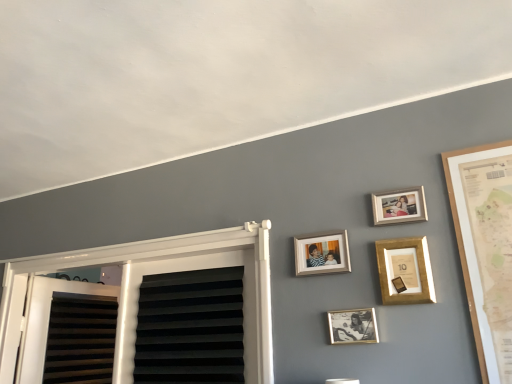
How much space does wooden photo frame at center, the 2th picture frame when ordered from top to bottom, occupy vertically?

6.08 inches.

The image size is (512, 384). Describe the element at coordinates (353, 326) in the screenshot. I see `gold-framed photo at center, acting as the first picture frame starting from the bottom` at that location.

Locate an element on the screen. The height and width of the screenshot is (384, 512). wooden photo frame at upper right, acting as the first picture frame starting from the top is located at coordinates (399, 206).

Is wooden photo frame at center, placed as the 3th picture frame when sorted from bottom to top, to the left or to the right of gold metallic picture frame at upper center, acting as the second picture frame starting from the bottom, in the image?

wooden photo frame at center, placed as the 3th picture frame when sorted from bottom to top, is to the left of gold metallic picture frame at upper center, acting as the second picture frame starting from the bottom.

Is the depth of wooden photo frame at center, placed as the 3th picture frame when sorted from bottom to top, less than that of gold metallic picture frame at upper center, acting as the second picture frame starting from the bottom?

No, it is not.

Is wooden photo frame at center, placed as the 3th picture frame when sorted from bottom to top, located outside gold metallic picture frame at upper center, acting as the second picture frame starting from the bottom?

Yes, wooden photo frame at center, placed as the 3th picture frame when sorted from bottom to top, is not within gold metallic picture frame at upper center, acting as the second picture frame starting from the bottom.

Based on the photo, which of these two, gold metallic picture frame at upper center, acting as the second picture frame starting from the bottom, or wooden photo frame at center, placed as the 3th picture frame when sorted from bottom to top, is thinner?

wooden photo frame at center, placed as the 3th picture frame when sorted from bottom to top, is thinner.

Does point (400, 259) lie in front of point (330, 239)?

Yes, it is in front of point (330, 239).

Can you see gold metallic picture frame at upper center, which is counted as the third picture frame, starting from the top, touching wooden photo frame at center, placed as the 3th picture frame when sorted from bottom to top?

No, gold metallic picture frame at upper center, which is counted as the third picture frame, starting from the top, is not next to wooden photo frame at center, placed as the 3th picture frame when sorted from bottom to top.

Which picture frame is the 2nd one when counting from the front of the wooden photo frame at upper right, placed as the 4th picture frame when sorted from bottom to top? Please provide its 2D coordinates.

[(405, 270)]

Can you confirm if wooden photo frame at upper right, placed as the 4th picture frame when sorted from bottom to top, is taller than gold metallic picture frame at upper center, acting as the second picture frame starting from the bottom?

In fact, wooden photo frame at upper right, placed as the 4th picture frame when sorted from bottom to top, may be shorter than gold metallic picture frame at upper center, acting as the second picture frame starting from the bottom.

Is wooden photo frame at upper right, placed as the 4th picture frame when sorted from bottom to top, spatially inside gold metallic picture frame at upper center, which is counted as the third picture frame, starting from the top, or outside of it?

wooden photo frame at upper right, placed as the 4th picture frame when sorted from bottom to top, is not inside gold metallic picture frame at upper center, which is counted as the third picture frame, starting from the top, it's outside.

Is wooden photo frame at upper right, placed as the 4th picture frame when sorted from bottom to top, directly adjacent to gold metallic picture frame at upper center, which is counted as the third picture frame, starting from the top?

No, wooden photo frame at upper right, placed as the 4th picture frame when sorted from bottom to top, is not next to gold metallic picture frame at upper center, which is counted as the third picture frame, starting from the top.

From the image's perspective, between wooden photo frame at center, placed as the 3th picture frame when sorted from bottom to top, and gold-framed photo at center, arranged as the 4th picture frame when viewed from the top, which one is located above?

wooden photo frame at center, placed as the 3th picture frame when sorted from bottom to top, from the image's perspective.

Is wooden photo frame at center, the 2th picture frame when ordered from top to bottom, smaller than gold-framed photo at center, arranged as the 4th picture frame when viewed from the top?

No.

Would you say wooden photo frame at center, the 2th picture frame when ordered from top to bottom, contains gold-framed photo at center, acting as the first picture frame starting from the bottom?

No.

Could you tell me if wooden photo frame at center, the 2th picture frame when ordered from top to bottom, is facing gold-framed photo at center, acting as the first picture frame starting from the bottom?

No.

Which of these two, gold-framed photo at center, acting as the first picture frame starting from the bottom, or wooden photo frame at center, the 2th picture frame when ordered from top to bottom, is thinner?

gold-framed photo at center, acting as the first picture frame starting from the bottom, is thinner.

Is point (358, 316) closer or farther from the camera than point (339, 259)?

Point (358, 316) is closer to the camera than point (339, 259).

Would you say gold-framed photo at center, acting as the first picture frame starting from the bottom, is a long distance from wooden photo frame at center, the 2th picture frame when ordered from top to bottom?

gold-framed photo at center, acting as the first picture frame starting from the bottom, is near wooden photo frame at center, the 2th picture frame when ordered from top to bottom, not far away.

From a real-world perspective, between gold-framed photo at center, arranged as the 4th picture frame when viewed from the top, and wooden photo frame at center, placed as the 3th picture frame when sorted from bottom to top, who is vertically higher?

wooden photo frame at center, placed as the 3th picture frame when sorted from bottom to top, is physically above.

From a real-world perspective, does gold-framed photo at center, arranged as the 4th picture frame when viewed from the top, sit lower than wooden photo frame at upper right, acting as the first picture frame starting from the top?

Yes, from a real-world perspective, gold-framed photo at center, arranged as the 4th picture frame when viewed from the top, is under wooden photo frame at upper right, acting as the first picture frame starting from the top.

Looking at this image, is gold-framed photo at center, acting as the first picture frame starting from the bottom, not within wooden photo frame at upper right, acting as the first picture frame starting from the top?

Yes.

Who is smaller, gold-framed photo at center, arranged as the 4th picture frame when viewed from the top, or wooden photo frame at upper right, placed as the 4th picture frame when sorted from bottom to top?

Smaller between the two is gold-framed photo at center, arranged as the 4th picture frame when viewed from the top.

Locate an element on the screen. the 2nd picture frame counting from the left side of the wooden photo frame at upper right, placed as the 4th picture frame when sorted from bottom to top is located at coordinates (353, 326).

Is wooden photo frame at upper right, acting as the first picture frame starting from the top, positioned far away from gold-framed photo at center, acting as the first picture frame starting from the bottom?

They are positioned close to each other.

Does wooden photo frame at upper right, acting as the first picture frame starting from the top, have a lesser height compared to gold-framed photo at center, arranged as the 4th picture frame when viewed from the top?

Incorrect, the height of wooden photo frame at upper right, acting as the first picture frame starting from the top, does not fall short of that of gold-framed photo at center, arranged as the 4th picture frame when viewed from the top.

Which object is wider, wooden photo frame at upper right, placed as the 4th picture frame when sorted from bottom to top, or gold-framed photo at center, acting as the first picture frame starting from the bottom?

Wider between the two is wooden photo frame at upper right, placed as the 4th picture frame when sorted from bottom to top.

Is wooden photo frame at upper right, placed as the 4th picture frame when sorted from bottom to top, completely or partially outside of gold-framed photo at center, arranged as the 4th picture frame when viewed from the top?

Yes, wooden photo frame at upper right, placed as the 4th picture frame when sorted from bottom to top, is located beyond the bounds of gold-framed photo at center, arranged as the 4th picture frame when viewed from the top.

At what (x,y) coordinates should I click in order to perform the action: click on picture frame that is the 1st one when counting downward from the wooden photo frame at center, the 2th picture frame when ordered from top to bottom (from the image's perspective). Please return your answer as a coordinate pair (x, y). This screenshot has width=512, height=384. Looking at the image, I should click on (405, 270).

Identify the location of the 2nd picture frame to the left of the gold metallic picture frame at upper center, which is counted as the third picture frame, starting from the top, counting from the anchor's position. (322, 253).

Based on their spatial positions, is gold-framed photo at center, acting as the first picture frame starting from the bottom, or gold metallic picture frame at upper center, acting as the second picture frame starting from the bottom, further from wooden photo frame at upper right, placed as the 4th picture frame when sorted from bottom to top?

gold-framed photo at center, acting as the first picture frame starting from the bottom, is positioned further to the anchor wooden photo frame at upper right, placed as the 4th picture frame when sorted from bottom to top.

When comparing their distances from wooden photo frame at upper right, acting as the first picture frame starting from the top, does wooden photo frame at center, the 2th picture frame when ordered from top to bottom, or gold metallic picture frame at upper center, acting as the second picture frame starting from the bottom, seem further?

Based on the image, wooden photo frame at center, the 2th picture frame when ordered from top to bottom, appears to be further to wooden photo frame at upper right, acting as the first picture frame starting from the top.

When comparing their distances from wooden photo frame at center, the 2th picture frame when ordered from top to bottom, does gold metallic picture frame at upper center, which is counted as the third picture frame, starting from the top, or wooden photo frame at upper right, placed as the 4th picture frame when sorted from bottom to top, seem closer?

The object closer to wooden photo frame at center, the 2th picture frame when ordered from top to bottom, is gold metallic picture frame at upper center, which is counted as the third picture frame, starting from the top.

When comparing their distances from wooden photo frame at center, the 2th picture frame when ordered from top to bottom, does gold metallic picture frame at upper center, which is counted as the third picture frame, starting from the top, or gold-framed photo at center, arranged as the 4th picture frame when viewed from the top, seem further?

gold-framed photo at center, arranged as the 4th picture frame when viewed from the top, lies further to wooden photo frame at center, the 2th picture frame when ordered from top to bottom, than the other object.

Looking at the image, which one is located further to gold-framed photo at center, arranged as the 4th picture frame when viewed from the top, wooden photo frame at center, the 2th picture frame when ordered from top to bottom, or wooden photo frame at upper right, acting as the first picture frame starting from the top?

The object further to gold-framed photo at center, arranged as the 4th picture frame when viewed from the top, is wooden photo frame at upper right, acting as the first picture frame starting from the top.

When comparing their distances from wooden photo frame at upper right, placed as the 4th picture frame when sorted from bottom to top, does gold metallic picture frame at upper center, which is counted as the third picture frame, starting from the top, or wooden photo frame at center, the 2th picture frame when ordered from top to bottom, seem closer?

gold metallic picture frame at upper center, which is counted as the third picture frame, starting from the top, is closer to wooden photo frame at upper right, placed as the 4th picture frame when sorted from bottom to top.

Based on their spatial positions, is gold metallic picture frame at upper center, acting as the second picture frame starting from the bottom, or gold-framed photo at center, acting as the first picture frame starting from the bottom, closer to wooden photo frame at upper right, acting as the first picture frame starting from the top?

Based on the image, gold metallic picture frame at upper center, acting as the second picture frame starting from the bottom, appears to be nearer to wooden photo frame at upper right, acting as the first picture frame starting from the top.

When comparing their distances from gold metallic picture frame at upper center, which is counted as the third picture frame, starting from the top, does wooden photo frame at upper right, placed as the 4th picture frame when sorted from bottom to top, or wooden photo frame at center, the 2th picture frame when ordered from top to bottom, seem closer?

Based on the image, wooden photo frame at upper right, placed as the 4th picture frame when sorted from bottom to top, appears to be nearer to gold metallic picture frame at upper center, which is counted as the third picture frame, starting from the top.

The image size is (512, 384). In order to click on picture frame between wooden photo frame at center, placed as the 3th picture frame when sorted from bottom to top, and gold metallic picture frame at upper center, which is counted as the third picture frame, starting from the top, from left to right in this screenshot , I will do `click(353, 326)`.